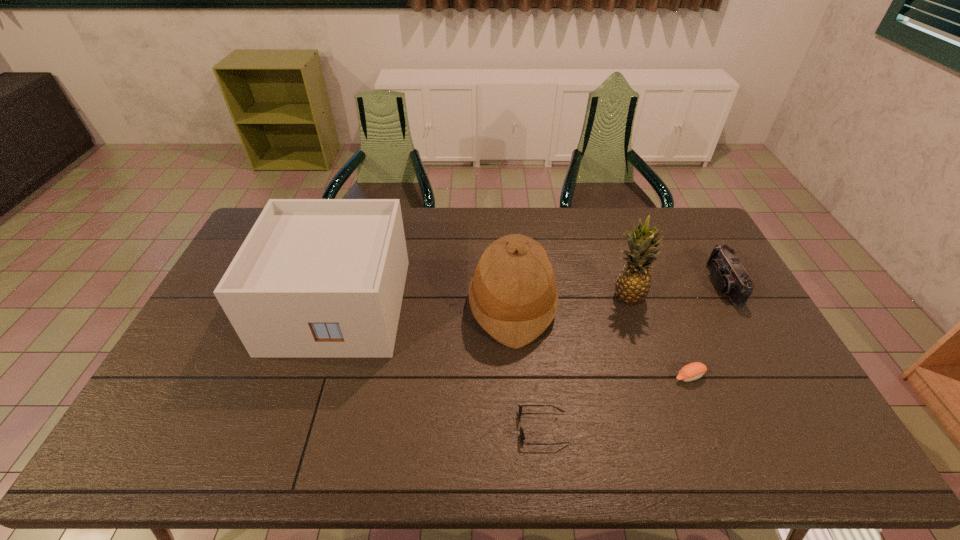
You are a GUI agent. You are given a task and a screenshot of the screen. Output one action in this format:
    pyautogui.click(x=<x>, y=<y>)
    Task: Click on the pineapple
    
    Given the screenshot: What is the action you would take?
    [x=633, y=284]

What are the coordinates of `hat` in the screenshot? It's located at (513, 296).

The width and height of the screenshot is (960, 540). Find the location of `box`. box is located at coordinates (315, 278).

I want to click on the third shortest object, so click(732, 279).

This screenshot has width=960, height=540. I want to click on the rightmost object, so click(732, 279).

This screenshot has width=960, height=540. Identify the location of the second nearest object. (693, 371).

This screenshot has height=540, width=960. What are the coordinates of `the second shortest object` in the screenshot? It's located at pyautogui.click(x=693, y=371).

Identify the location of the shortest object. (522, 437).

Locate an element on the screen. Image resolution: width=960 pixels, height=540 pixels. sunglasses is located at coordinates (522, 437).

You are a GUI agent. You are given a task and a screenshot of the screen. Output one action in this format:
    pyautogui.click(x=<x>, y=<y>)
    Task: Click on the free space located 0.220m on the left of the pineapple
    The image size is (960, 540).
    Given the screenshot: What is the action you would take?
    pyautogui.click(x=540, y=296)